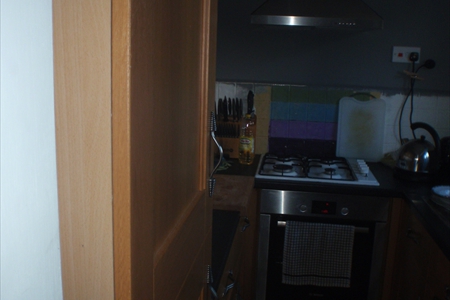
I want to click on kitchen knife, so click(219, 110), click(223, 107), click(229, 107), click(233, 108), click(237, 107), click(240, 107).